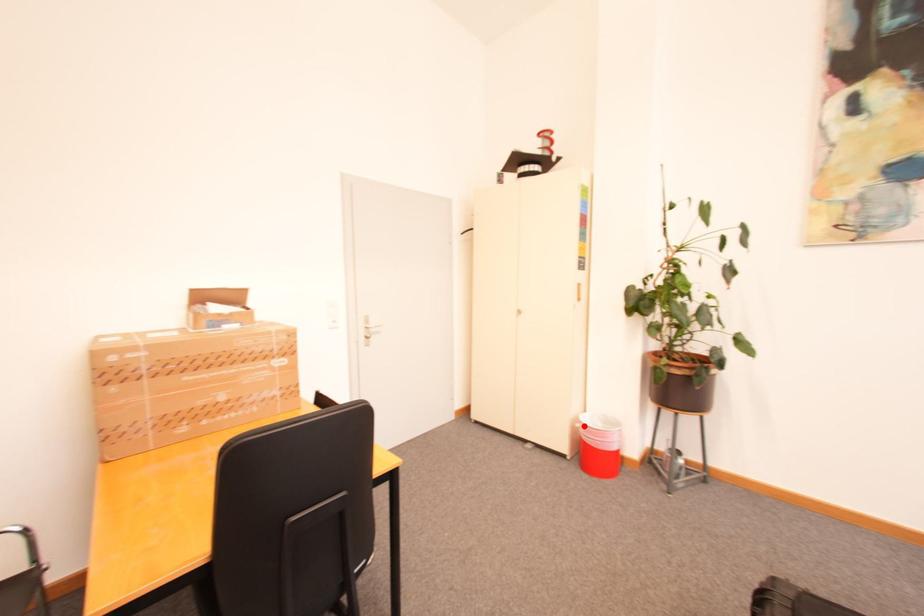
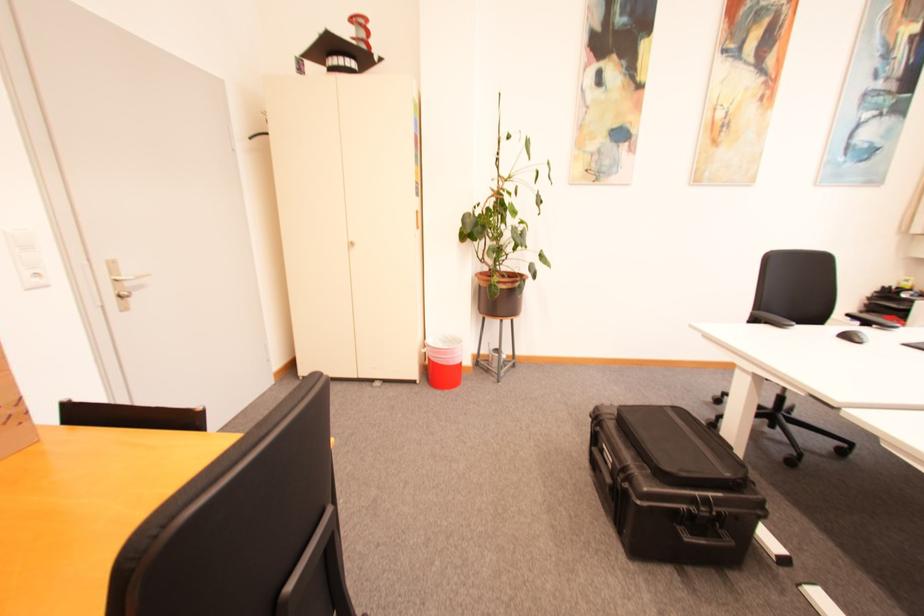
Locate, in the second image, the point that corresponds to the highlighted location in the first image.

(431, 351)